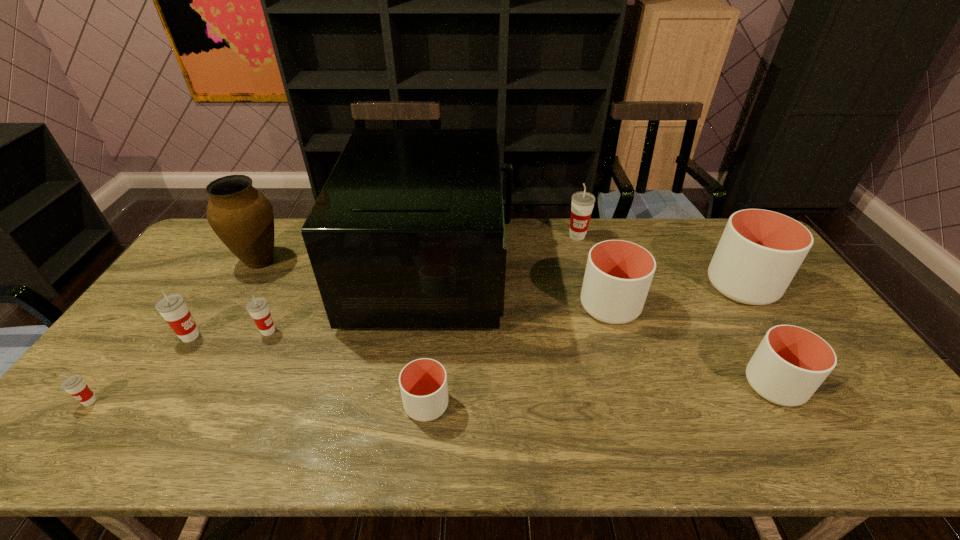
The height and width of the screenshot is (540, 960). Find the location of `free space between the tallest object and the third white cup from right to left`. free space between the tallest object and the third white cup from right to left is located at coordinates (521, 287).

Identify the location of free area in between the third biggest white cup and the third smallest white cup. This screenshot has height=540, width=960. (692, 346).

This screenshot has height=540, width=960. In order to click on the fifth closest object to the seventh object from right to left in this screenshot , I will do `click(423, 382)`.

Identify which object is located as the sixth nearest to the rightmost red cup. Please provide its 2D coordinates. Your answer should be formatted as a tuple, i.e. [(x, y)], where the tuple contains the x and y coordinates of a point satisfying the conditions above.

[(242, 217)]

Point out which cup is positioned as the seventh nearest to the sixth cup from right to left. Please provide its 2D coordinates. Your answer should be formatted as a tuple, i.e. [(x, y)], where the tuple contains the x and y coordinates of a point satisfying the conditions above.

[(760, 251)]

Locate which cup ranks fourth in proximity to the biggest red cup. Please provide its 2D coordinates. Your answer should be formatted as a tuple, i.e. [(x, y)], where the tuple contains the x and y coordinates of a point satisfying the conditions above.

[(423, 382)]

Locate which white cup is the third closest to the second smallest white cup. Please provide its 2D coordinates. Your answer should be formatted as a tuple, i.e. [(x, y)], where the tuple contains the x and y coordinates of a point satisfying the conditions above.

[(423, 382)]

Identify the location of white cup that stands as the fourth closest to the biggest red cup. (423, 382).

I want to click on red cup that is the fourth closest to the second white cup from left to right, so click(75, 385).

You are a GUI agent. You are given a task and a screenshot of the screen. Output one action in this format:
    pyautogui.click(x=<x>, y=<y>)
    Task: Click on the closest red cup to the rightmost red cup
    
    Given the screenshot: What is the action you would take?
    pyautogui.click(x=258, y=308)